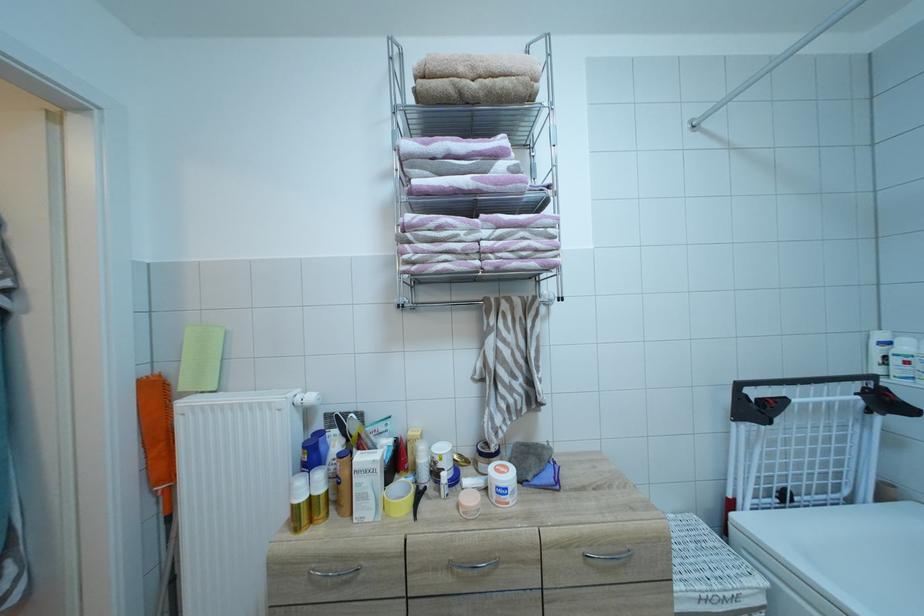
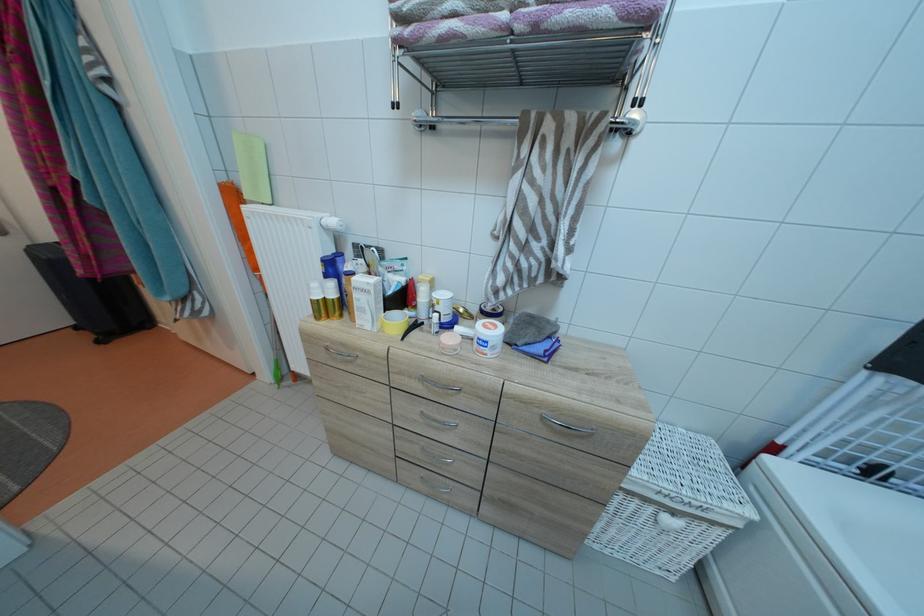
Where in the second image is the point corresponding to [541,304] from the first image?

(611, 120)